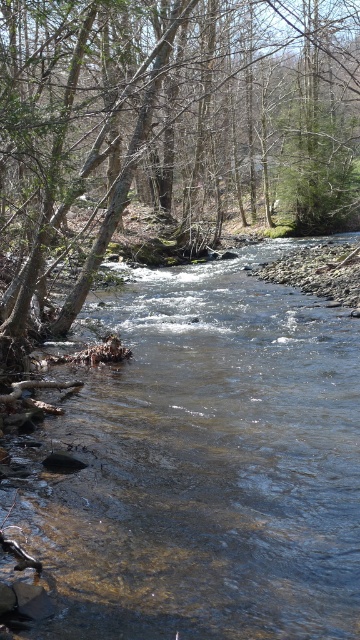
You are standing at the edge of the river and want to cross to the other side. There is a clear water stream at center and a brown bark tree at left. Which one is closer to you?

The clear water stream at center is 19.85 meters away from the brown bark tree at left, so the brown bark tree at left is closer to you.

You are standing on the riverbank and want to cross the river to the opposite side. You see the clear water stream at center and the brown bark tree at left. Which direction should you head towards to find the shallowest part of the river?

The clear water stream at center is to the left of brown bark tree at left. Since clear water often indicates shallower areas due to sunlight reflecting off the riverbed, you should head towards the clear water stream at center to find the shallowest part of the river.

You are planning to cross the river using a wooden plank that is 2 meters long. You see the clear water stream at center and the brown bark tree at left. Which location would allow you to safely place the plank without it touching the riverbed?

The clear water stream at center has a width less than the brown bark tree at left. Since the plank is 2 meters long, it can safely span the narrower clear water stream at center without touching the riverbed, provided the distance between the banks there is within 2 meters.